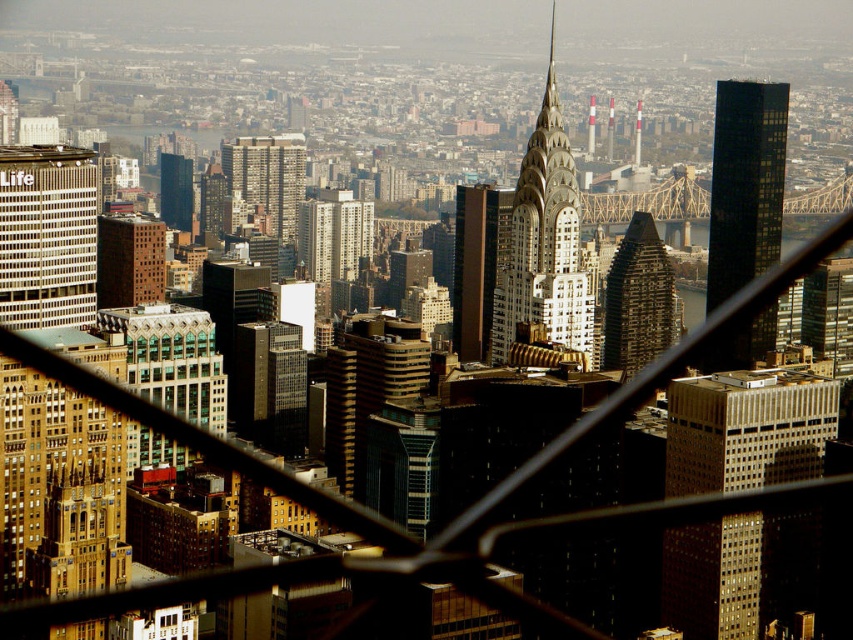
Question: Can you confirm if black glass skyscraper at right is thinner than white glass building at left?

Choices:
 (A) yes
 (B) no

Answer: (A)

Question: Which object is farther from the camera taking this photo?

Choices:
 (A) white glass building at left
 (B) black glass skyscraper at right
 (C) gold reflective glass skyscraper at center-right
 (D) smooth white spire at center

Answer: (A)

Question: Is brown glass skyscraper at center in front of smooth white spire at center?

Choices:
 (A) yes
 (B) no

Answer: (A)

Question: Considering the real-world distances, which object is closest to the white glass building at left?

Choices:
 (A) smooth white spire at center
 (B) shiny metallic skyscraper at center-right
 (C) smooth concrete spire at center
 (D) brown glass skyscraper at center

Answer: (D)

Question: Considering the real-world distances, which object is closest to the white glass building at left?

Choices:
 (A) brown glass skyscraper at center
 (B) shiny metallic skyscraper at center-right

Answer: (A)

Question: Does black glass skyscraper at right appear on the right side of smooth concrete spire at center?

Choices:
 (A) no
 (B) yes

Answer: (B)